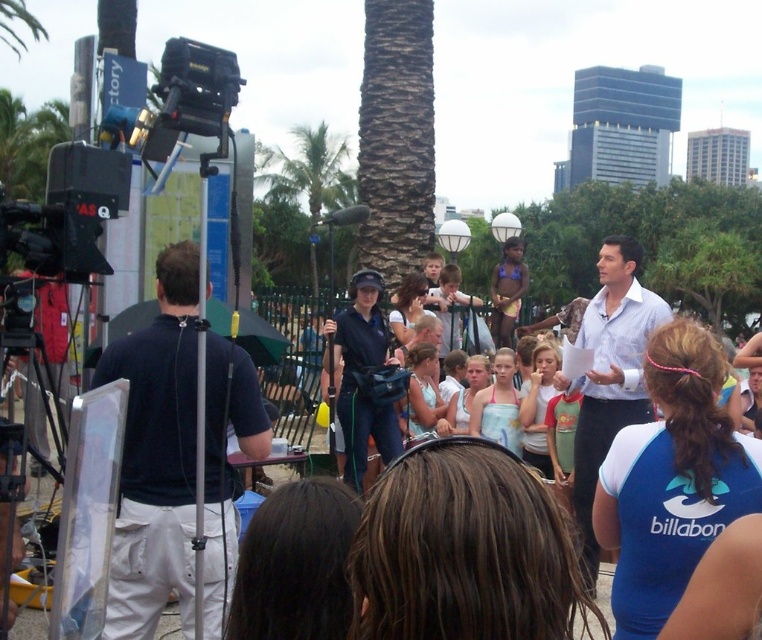
Question: Which of these objects is positioned farthest from the green leafy palm tree at center?

Choices:
 (A) white textured shirt at center
 (B) dark blue shirt at left

Answer: (A)

Question: Is white textured shirt at center closer to the viewer compared to green leafy palm tree at center?

Choices:
 (A) no
 (B) yes

Answer: (B)

Question: Among these points, which one is farthest from the camera?

Choices:
 (A) coord(232,477)
 (B) coord(298,189)

Answer: (B)

Question: Where is dark blue shirt at left located in relation to green leafy palm tree at center in the image?

Choices:
 (A) left
 (B) right

Answer: (B)

Question: Is white textured shirt at center positioned in front of green leafy palm tree at center?

Choices:
 (A) no
 (B) yes

Answer: (B)

Question: Among these points, which one is farthest from the camera?

Choices:
 (A) (142, 448)
 (B) (607, 292)
 (C) (311, 148)

Answer: (C)